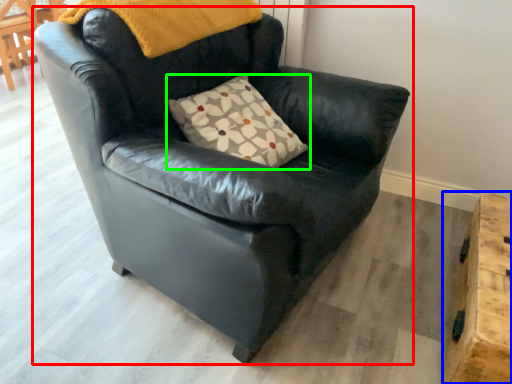
Question: Estimate the real-world distances between objects in this image. Which object is closer to chair (highlighted by a red box), table (highlighted by a blue box) or pillow (highlighted by a green box)?

Choices:
 (A) table
 (B) pillow

Answer: (B)